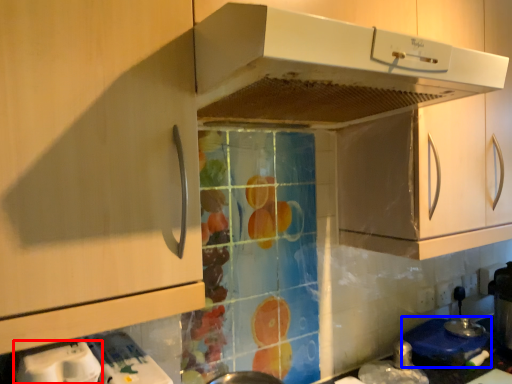
Question: Which of the following is the closest to the observer, appliance (highlighted by a red box) or appliance (highlighted by a blue box)?

Choices:
 (A) appliance
 (B) appliance

Answer: (A)